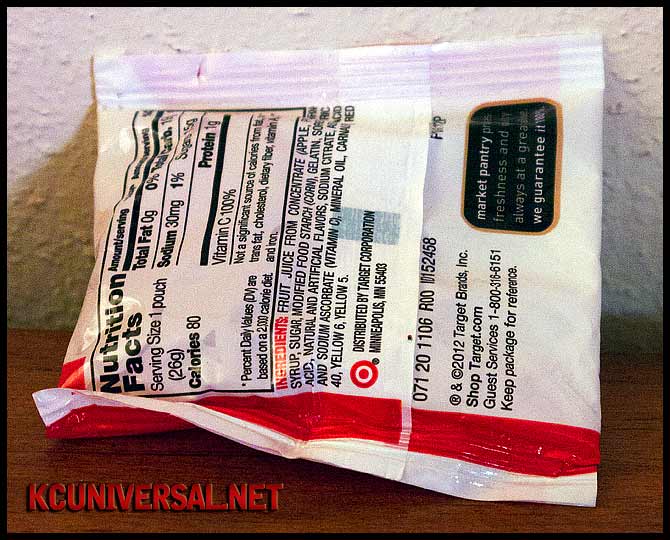
Identify the location of wall. The height and width of the screenshot is (540, 670). (316, 32).